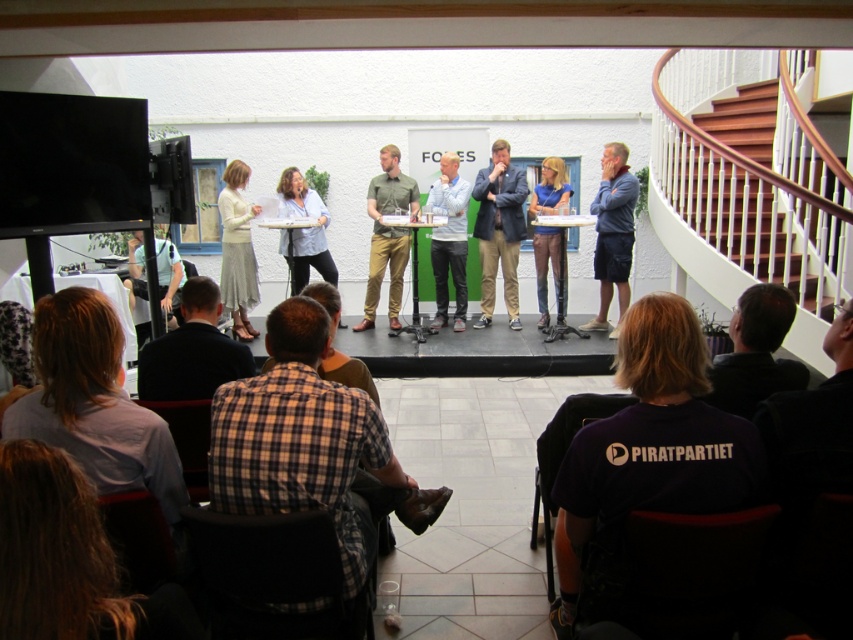
You are organizing a photo shoot and need to place two shirts on a display rack. The purple cotton shirt at lower right and the green cotton shirt at center must be arranged side by side. Which shirt should you place on the left side to ensure they fit within the rack without overlapping?

The purple cotton shirt at lower right has a lesser width compared to the green cotton shirt at center. To prevent overlapping, place the narrower purple cotton shirt at lower right on the left side and the wider green cotton shirt at center on the right side.